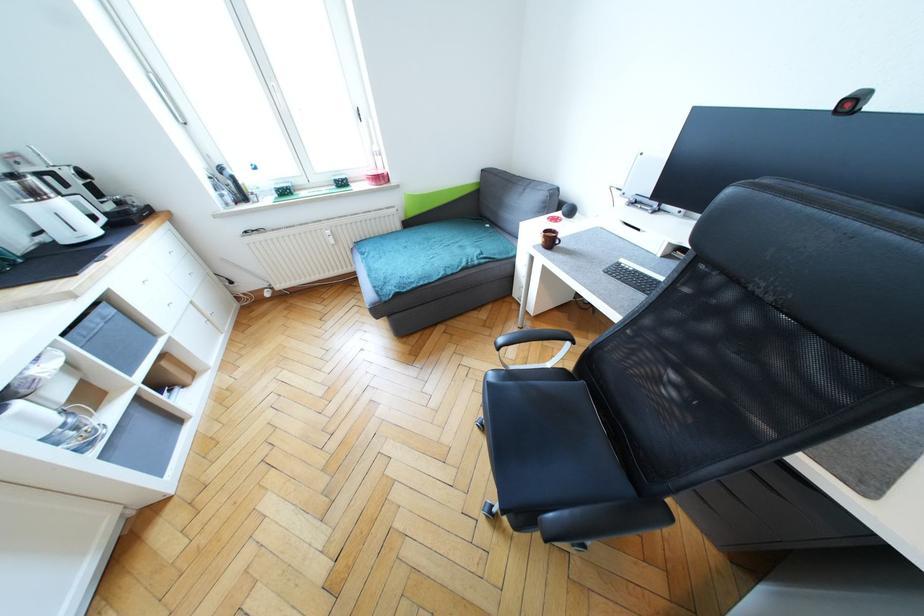
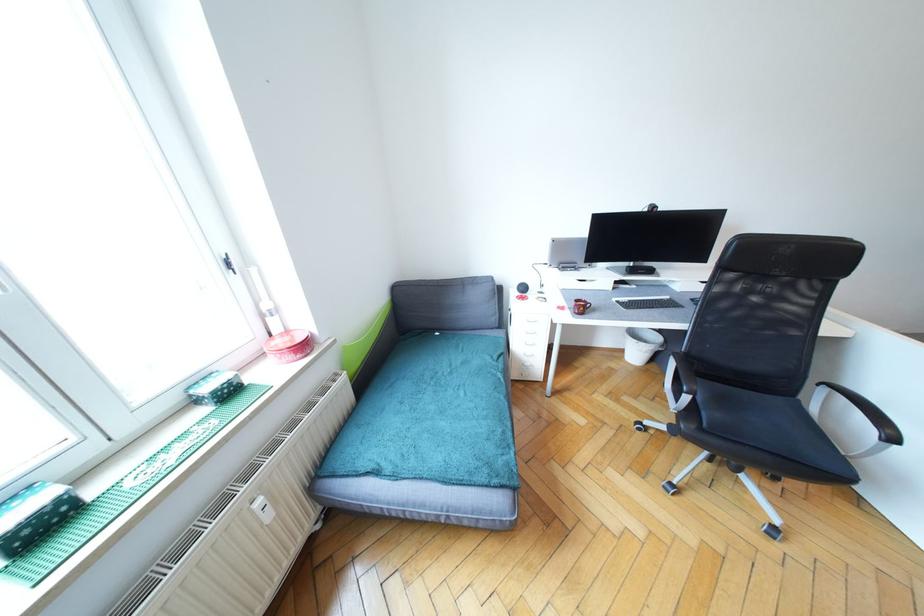
Where in the second image is the point corresponding to the point at 379,150 from the first image?

(270, 307)